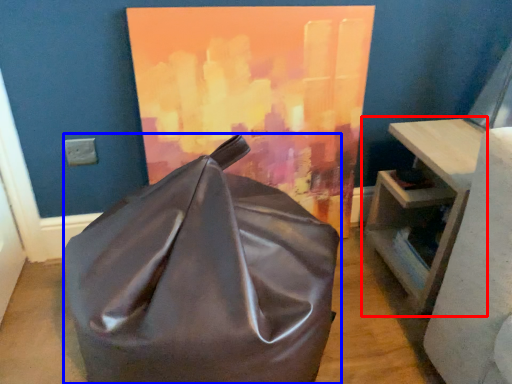
Question: Which point is further to the camera, table (highlighted by a red box) or furniture (highlighted by a blue box)?

Choices:
 (A) table
 (B) furniture

Answer: (A)